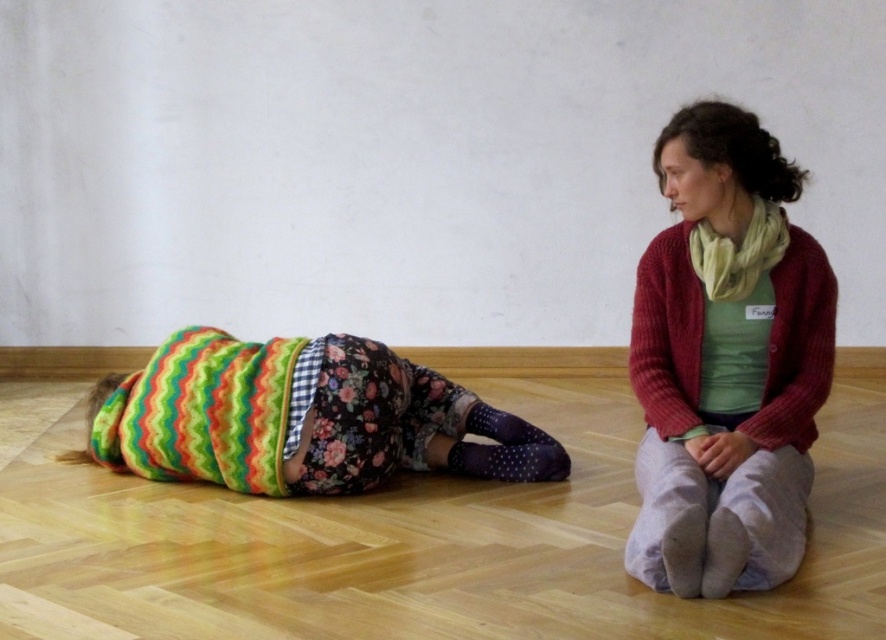
You are standing at the origin point in the image. Which direction should you move to reach the multicolored knitted blanket at lower left?

The multicolored knitted blanket at lower left is located at point 0.655 on the x axis and 0.342 on the y axis. Since you are at the origin point, you should move to the right and slightly upwards to reach it.

You are organizing a cozy indoor picnic and need to decide which item to place first. Since the multicolored knitted blanket at lower left and the knitted yellow scarf at upper right are both available, which one should you lay out first to cover more floor space?

The multicolored knitted blanket at lower left should be laid out first because it is larger in size than the knitted yellow scarf at upper right, allowing it to cover more floor space.